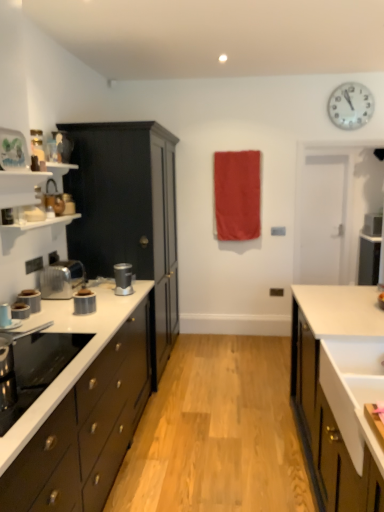
Question: From a real-world perspective, is metallic silver toaster at left, which is the second kitchen appliance from front to back, physically below polished stainless steel kettle at left, placed as the fifth kitchen appliance when sorted from front to back?

Choices:
 (A) yes
 (B) no

Answer: (A)

Question: Does metallic silver toaster at left, which is the second kitchen appliance from front to back, appear on the left side of polished stainless steel kettle at left, placed as the fifth kitchen appliance when sorted from front to back?

Choices:
 (A) yes
 (B) no

Answer: (A)

Question: Can you confirm if metallic silver toaster at left, the 5th kitchen appliance positioned from the back, is thinner than polished stainless steel kettle at left, placed as the 2th kitchen appliance when sorted from back to front?

Choices:
 (A) no
 (B) yes

Answer: (B)

Question: Considering the relative sizes of metallic silver toaster at left, which is the second kitchen appliance from front to back, and polished stainless steel kettle at left, placed as the fifth kitchen appliance when sorted from front to back, in the image provided, is metallic silver toaster at left, which is the second kitchen appliance from front to back, shorter than polished stainless steel kettle at left, placed as the fifth kitchen appliance when sorted from front to back,?

Choices:
 (A) no
 (B) yes

Answer: (B)

Question: Is the position of metallic silver toaster at left, which is the second kitchen appliance from front to back, more distant than that of polished stainless steel kettle at left, placed as the 2th kitchen appliance when sorted from back to front?

Choices:
 (A) no
 (B) yes

Answer: (A)

Question: Is metallic silver toaster at left, the 5th kitchen appliance positioned from the back, at the right side of polished stainless steel kettle at left, placed as the fifth kitchen appliance when sorted from front to back?

Choices:
 (A) yes
 (B) no

Answer: (B)

Question: From a real-world perspective, is matte black cabinet at left, arranged as the 2th cabinetry when viewed from the right, located beneath satin silver blender at center, the 1th kitchen appliance positioned from the back?

Choices:
 (A) yes
 (B) no

Answer: (B)

Question: From the image's perspective, is matte black cabinet at left, arranged as the 2th cabinetry when viewed from the right, on satin silver blender at center, arranged as the 6th kitchen appliance when viewed from the front?

Choices:
 (A) no
 (B) yes

Answer: (B)

Question: Considering the relative positions of matte black cabinet at left, arranged as the 2th cabinetry when viewed from the right, and satin silver blender at center, arranged as the 6th kitchen appliance when viewed from the front, in the image provided, is matte black cabinet at left, arranged as the 2th cabinetry when viewed from the right, to the left of satin silver blender at center, arranged as the 6th kitchen appliance when viewed from the front, from the viewer's perspective?

Choices:
 (A) yes
 (B) no

Answer: (A)

Question: Would you say matte black cabinet at left, placed as the 2th cabinetry when sorted from left to right, is a long distance from satin silver blender at center, arranged as the 6th kitchen appliance when viewed from the front?

Choices:
 (A) yes
 (B) no

Answer: (B)

Question: From a real-world perspective, is matte black cabinet at left, placed as the 2th cabinetry when sorted from left to right, over satin silver blender at center, arranged as the 6th kitchen appliance when viewed from the front?

Choices:
 (A) no
 (B) yes

Answer: (B)

Question: Considering the relative sizes of matte black cabinet at left, placed as the 2th cabinetry when sorted from left to right, and satin silver blender at center, arranged as the 6th kitchen appliance when viewed from the front, in the image provided, is matte black cabinet at left, placed as the 2th cabinetry when sorted from left to right, wider than satin silver blender at center, arranged as the 6th kitchen appliance when viewed from the front,?

Choices:
 (A) no
 (B) yes

Answer: (B)

Question: Can you see red fabric at center touching satin silver blender at center, arranged as the 6th kitchen appliance when viewed from the front?

Choices:
 (A) yes
 (B) no

Answer: (B)